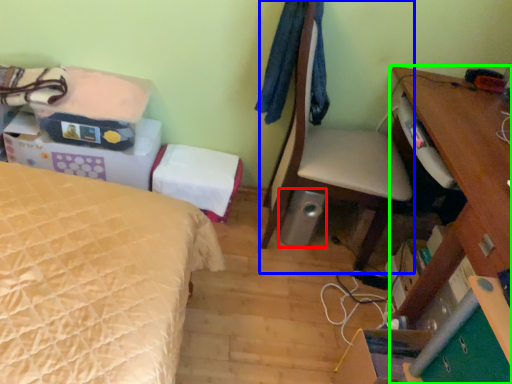
Question: Which object is the farthest from loudspeaker (highlighted by a red box)? Choose among these: chair (highlighted by a blue box) or desk (highlighted by a green box).

Choices:
 (A) chair
 (B) desk

Answer: (B)